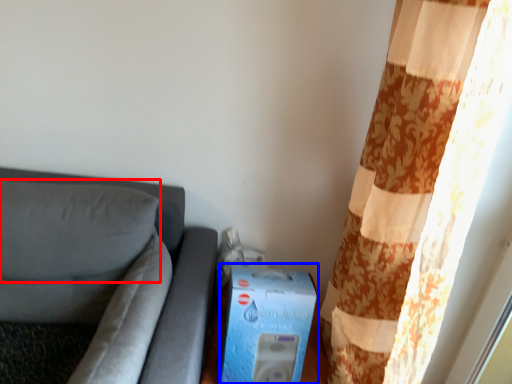
Question: Which object appears farthest to the camera in this image, pillow (highlighted by a red box) or box (highlighted by a blue box)?

Choices:
 (A) pillow
 (B) box

Answer: (B)